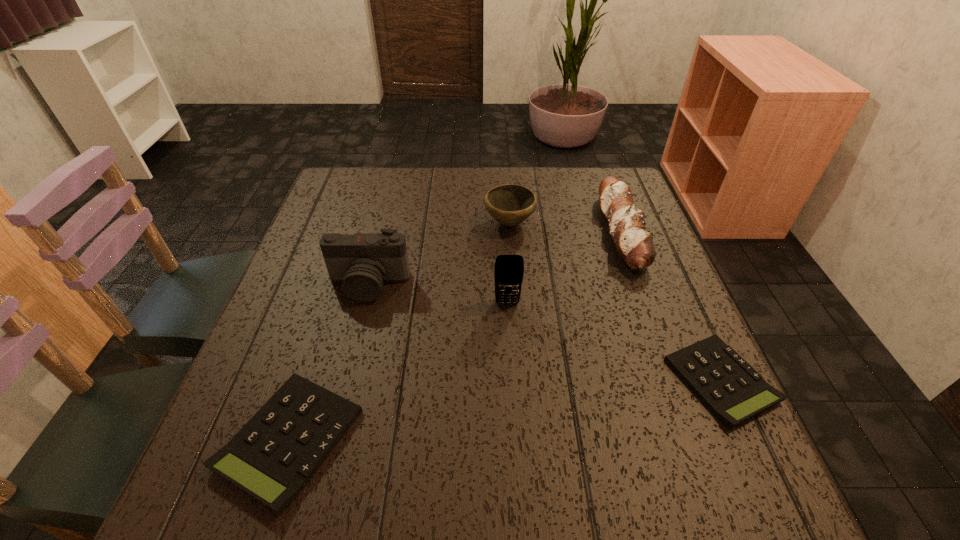
To achieve uniform spacing by inserting another calculator among them, please point to a free space for this new calculator. Please provide its 2D coordinates. Your answer should be formatted as a tuple, i.e. [(x, y)], where the tuple contains the x and y coordinates of a point satisfying the conditions above.

[(516, 408)]